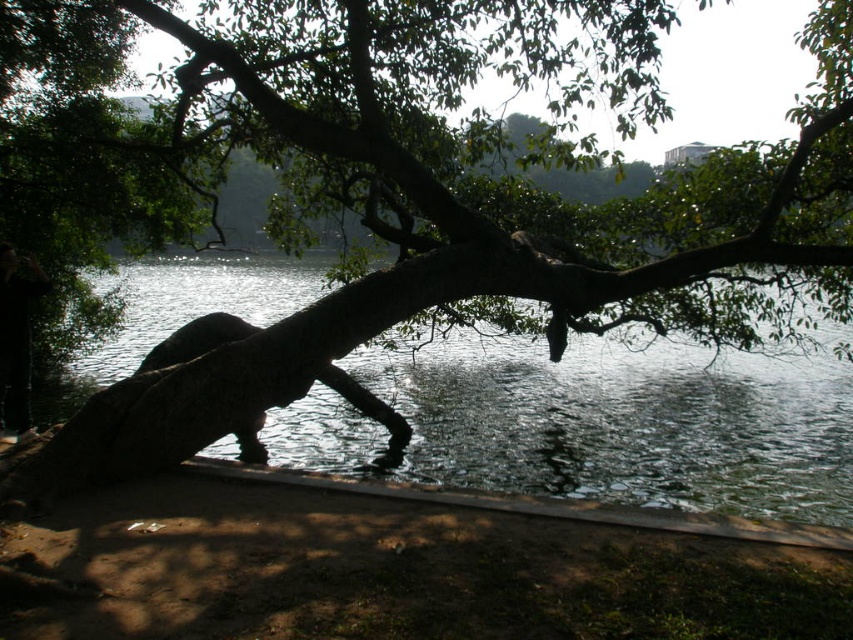
Question: Does clear water at lower center appear over black matte person at left?

Choices:
 (A) yes
 (B) no

Answer: (B)

Question: Among these objects, which one is nearest to the camera?

Choices:
 (A) black matte person at left
 (B) smooth bark tree trunk at center

Answer: (B)

Question: Is smooth bark tree trunk at center bigger than black matte person at left?

Choices:
 (A) no
 (B) yes

Answer: (B)

Question: Is smooth bark tree trunk at center above clear water at lower center?

Choices:
 (A) no
 (B) yes

Answer: (B)

Question: Estimate the real-world distances between objects in this image. Which object is farther from the smooth bark tree trunk at center?

Choices:
 (A) black matte person at left
 (B) clear water at lower center

Answer: (A)

Question: Which of the following is the closest to the observer?

Choices:
 (A) black matte person at left
 (B) clear water at lower center
 (C) smooth bark tree trunk at center

Answer: (C)